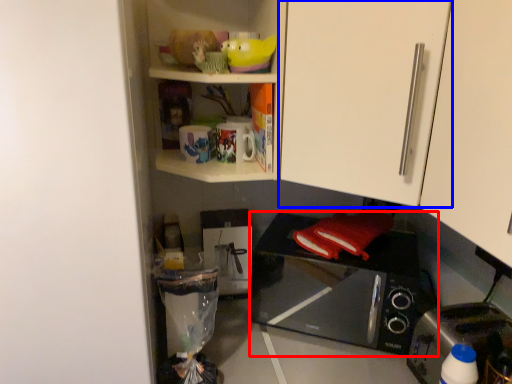
Question: Which of the following is the closest to the observer, microwave oven (highlighted by a red box) or cabinetry (highlighted by a blue box)?

Choices:
 (A) microwave oven
 (B) cabinetry

Answer: (B)